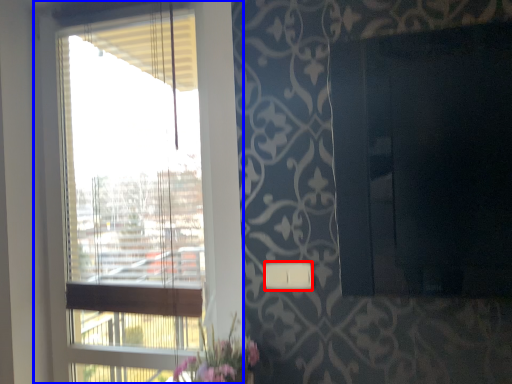
Question: Which object is closer to the camera taking this photo, light switch (highlighted by a red box) or window (highlighted by a blue box)?

Choices:
 (A) light switch
 (B) window

Answer: (A)